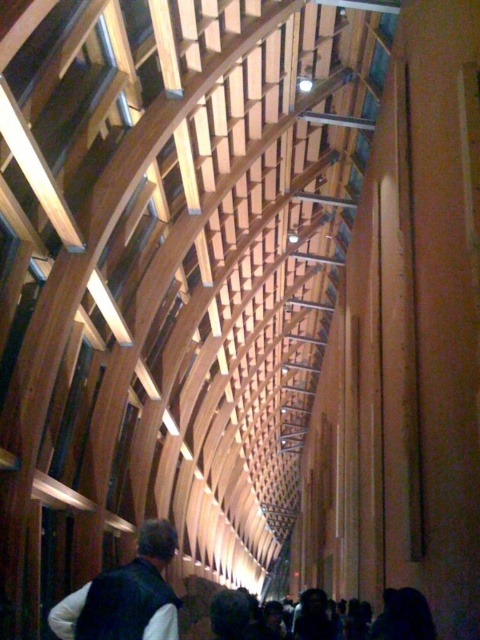
You are an interior designer assessing the placement of items in the architectural space. You notice the dark brown leather jacket at lower left and the dark hair at lower center. Which object is positioned higher in the scene?

The dark brown leather jacket at lower left is located above the dark hair at lower center, so it is positioned higher in the scene.